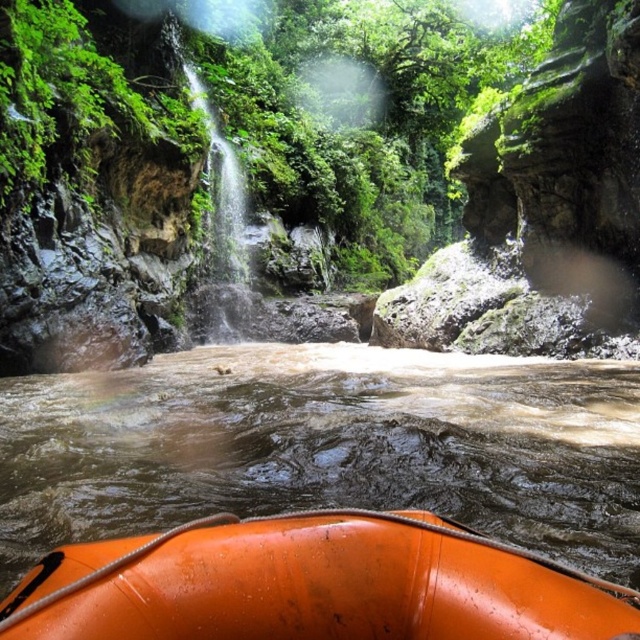
Question: Can you confirm if orange rubber raft at lower center is positioned to the left of orange rubber boat at lower center?

Choices:
 (A) yes
 (B) no

Answer: (B)

Question: Which point is closer to the camera?

Choices:
 (A) orange rubber raft at lower center
 (B) orange rubber boat at lower center

Answer: (B)

Question: Is orange rubber raft at lower center bigger than orange rubber boat at lower center?

Choices:
 (A) yes
 (B) no

Answer: (A)

Question: Does orange rubber raft at lower center have a smaller size compared to orange rubber boat at lower center?

Choices:
 (A) no
 (B) yes

Answer: (A)